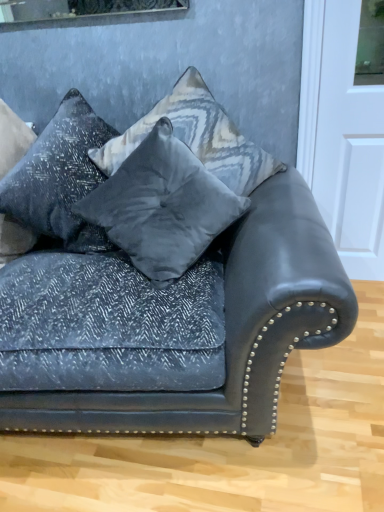
Question: Is point (119, 141) closer or farther from the camera than point (299, 307)?

Choices:
 (A) farther
 (B) closer

Answer: (A)

Question: Is velvet gray pillow at center, the 3th pillow in the left-to-right sequence, to the left or to the right of velvet dark blue couch at center in the image?

Choices:
 (A) left
 (B) right

Answer: (B)

Question: Which of these objects is positioned closest to the velvet dark blue couch at center?

Choices:
 (A) velvet gray pillow at center, the 3th pillow in the left-to-right sequence
 (B) velvet gray pillow at center, placed as the 2th pillow when sorted from right to left
 (C) white glossy door at upper right
 (D) textured gray pillow at upper left, which is the 3th pillow from right to left

Answer: (B)

Question: Estimate the real-world distances between objects in this image. Which object is farther from the velvet dark blue couch at center?

Choices:
 (A) velvet gray pillow at center, placed as the 2th pillow when sorted from right to left
 (B) textured gray pillow at upper left, which is the first pillow in left-to-right order
 (C) velvet gray pillow at center, the 3th pillow in the left-to-right sequence
 (D) white glossy door at upper right

Answer: (D)